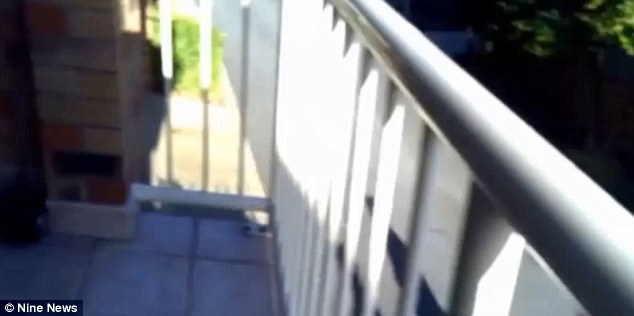
Locate an element on the screen. Image resolution: width=634 pixels, height=316 pixels. top rail is located at coordinates (566, 212), (392, 34).